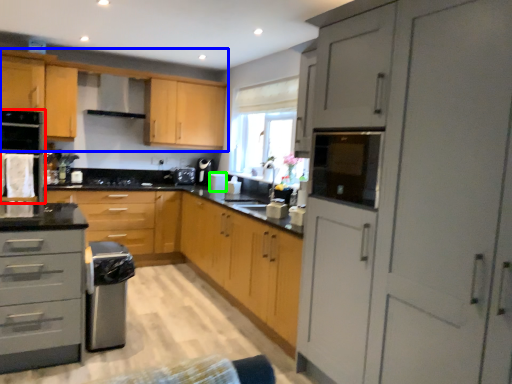
Question: Which is nearer to the home appliance (highlighted by a red box)? cabinetry (highlighted by a blue box) or appliance (highlighted by a green box).

Choices:
 (A) cabinetry
 (B) appliance

Answer: (A)